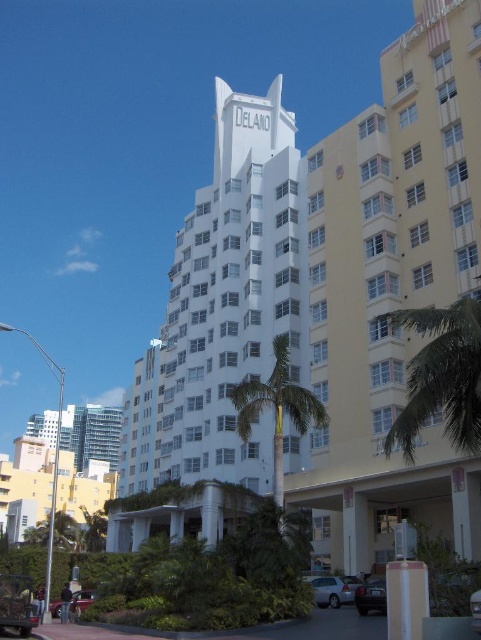
Question: Is silver metallic sedan at lower center to the left of metallic silver car at lower left from the viewer's perspective?

Choices:
 (A) yes
 (B) no

Answer: (B)

Question: Among these points, which one is nearest to the camera?

Choices:
 (A) (359, 282)
 (B) (75, 600)
 (C) (433, 406)
 (D) (357, 593)

Answer: (C)

Question: Which point is farther to the camera?

Choices:
 (A) (266, 227)
 (B) (324, 588)

Answer: (A)

Question: Based on their relative distances, which object is nearer to the metallic silver car at lower right?

Choices:
 (A) green leafy palm tree at right
 (B) green leafy palm tree at center
 (C) metallic silver car at lower left
 (D) white smooth building at center

Answer: (A)

Question: Does green leafy palm tree at center have a greater width compared to metallic silver car at lower left?

Choices:
 (A) yes
 (B) no

Answer: (A)

Question: Does green leafy palm tree at center have a smaller size compared to metallic silver car at lower left?

Choices:
 (A) no
 (B) yes

Answer: (A)